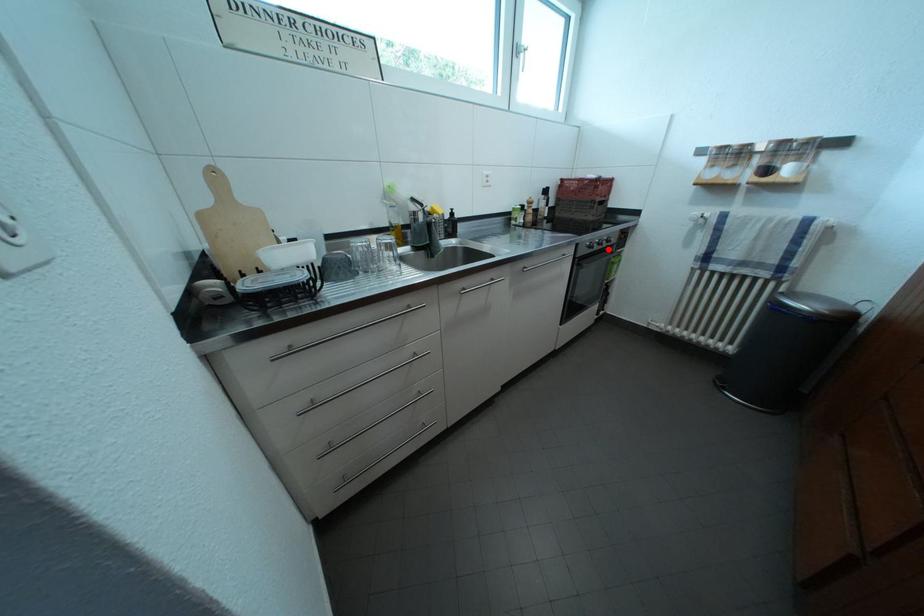
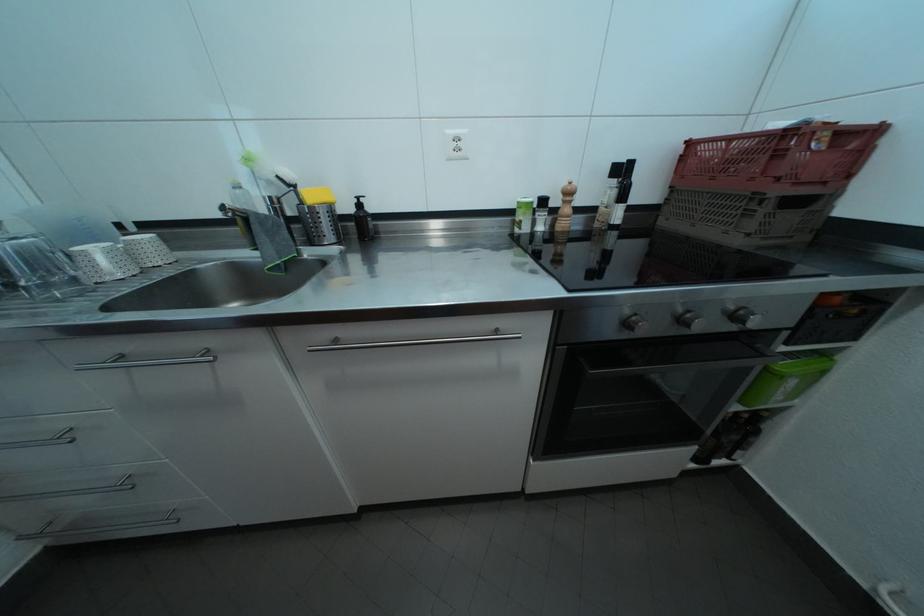
Where in the second image is the point corresponding to the highlighted location from the first image?

(691, 326)